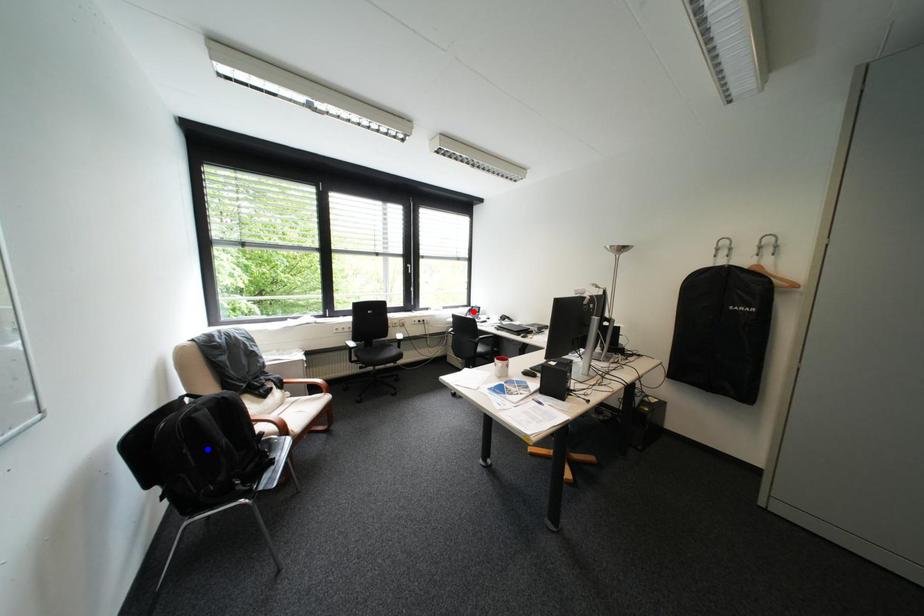
Question: In the image, two points are highlighted. Which point is nearer to the camera? Reply with the corresponding letter.

Choices:
 (A) blue point
 (B) red point

Answer: (A)